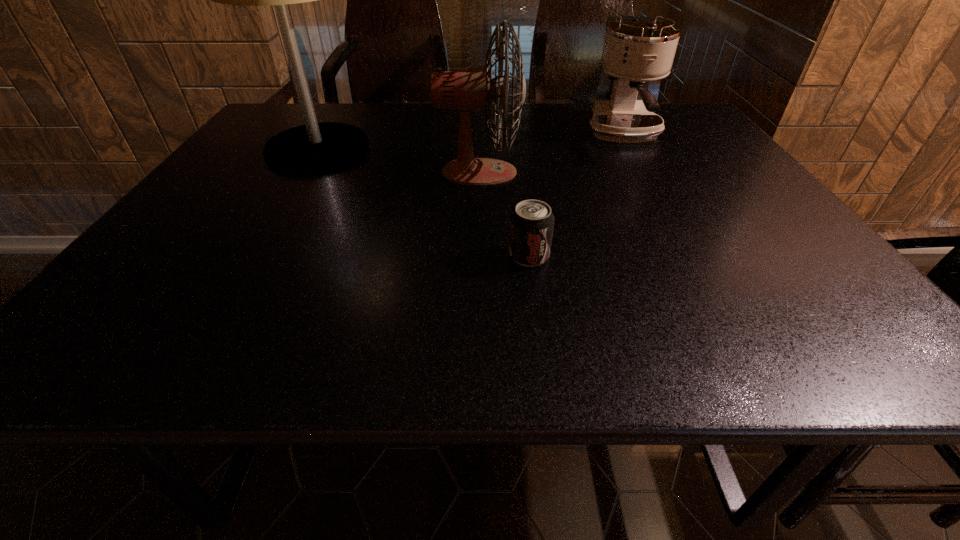
Choose which object is the nearest neighbor to the tallest object. Please provide its 2D coordinates. Your answer should be formatted as a tuple, i.e. [(x, y)], where the tuple contains the x and y coordinates of a point satisfying the conditions above.

[(473, 89)]

This screenshot has width=960, height=540. Find the location of `free space that satisfies the following two spatial constraints: 1. on the back side of the shortest object; 2. in front of the fan to direct airflow`. free space that satisfies the following two spatial constraints: 1. on the back side of the shortest object; 2. in front of the fan to direct airflow is located at coordinates (518, 173).

Find the location of a particular element. The height and width of the screenshot is (540, 960). vacant region that satisfies the following two spatial constraints: 1. on the front-facing side of the coffee maker; 2. in front of the fan to direct airflow is located at coordinates (647, 173).

This screenshot has width=960, height=540. Identify the location of vacant region that satisfies the following two spatial constraints: 1. on the front-facing side of the coffee maker; 2. in front of the fan to direct airflow. (647, 173).

In order to click on free region that satisfies the following two spatial constraints: 1. in front of the nearest object to direct airflow; 2. on the left side of the fan in this screenshot , I will do `click(479, 255)`.

Image resolution: width=960 pixels, height=540 pixels. Identify the location of free space that satisfies the following two spatial constraints: 1. on the front-facing side of the coffee maker; 2. in front of the fan to direct airflow. (647, 173).